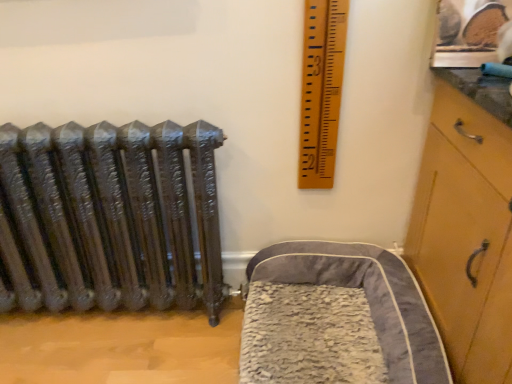
Question: Is wooden ruler at upper right not close to gray plush pet bed at lower right?

Choices:
 (A) no
 (B) yes

Answer: (A)

Question: Is wooden ruler at upper right positioned before gray plush pet bed at lower right?

Choices:
 (A) yes
 (B) no

Answer: (B)

Question: From the image's perspective, is wooden ruler at upper right under gray plush pet bed at lower right?

Choices:
 (A) no
 (B) yes

Answer: (A)

Question: Is wooden ruler at upper right not inside gray plush pet bed at lower right?

Choices:
 (A) yes
 (B) no

Answer: (A)

Question: From a real-world perspective, is wooden ruler at upper right located beneath gray plush pet bed at lower right?

Choices:
 (A) no
 (B) yes

Answer: (A)

Question: Is gray plush pet bed at lower right a part of wooden ruler at upper right?

Choices:
 (A) yes
 (B) no

Answer: (B)

Question: Is gray plush pet bed at lower right aimed at wooden ruler at upper right?

Choices:
 (A) yes
 (B) no

Answer: (B)

Question: Considering the relative positions of gray plush pet bed at lower right and wooden ruler at upper right in the image provided, is gray plush pet bed at lower right to the left of wooden ruler at upper right from the viewer's perspective?

Choices:
 (A) yes
 (B) no

Answer: (B)

Question: Are gray plush pet bed at lower right and wooden ruler at upper right located far from each other?

Choices:
 (A) yes
 (B) no

Answer: (B)

Question: Can you confirm if gray plush pet bed at lower right is bigger than wooden ruler at upper right?

Choices:
 (A) no
 (B) yes

Answer: (B)

Question: Is gray plush pet bed at lower right positioned beyond the bounds of wooden ruler at upper right?

Choices:
 (A) yes
 (B) no

Answer: (A)

Question: From a real-world perspective, is gray plush pet bed at lower right on top of wooden ruler at upper right?

Choices:
 (A) no
 (B) yes

Answer: (A)

Question: In terms of width, does gray plush pet bed at lower right look wider or thinner when compared to wooden ruler at upper right?

Choices:
 (A) wide
 (B) thin

Answer: (A)